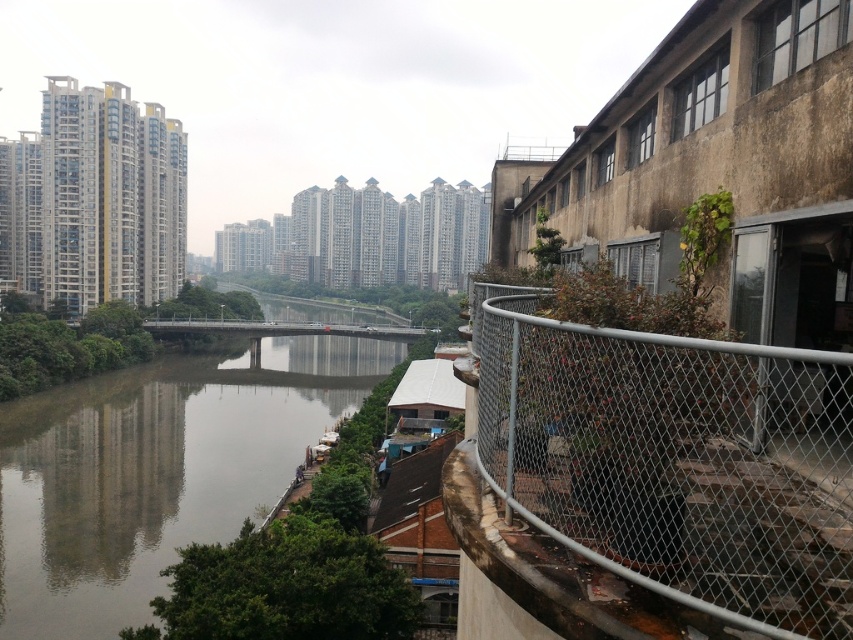
You are standing at the point marked by the coordinate point [675,460] in the image. What object are you standing on?

You are standing on the silver chainlink fence at right, as the point [675,460] corresponds to its location in the image.

You are standing at the point with coordinates point [482,355] and want to move to the point with coordinates point [135,477]. According to the scene, which direction should you move to reach your destination?

To move from point [482,355] to point [135,477], you should move downward because point [135,477] is below point [482,355] in the image.